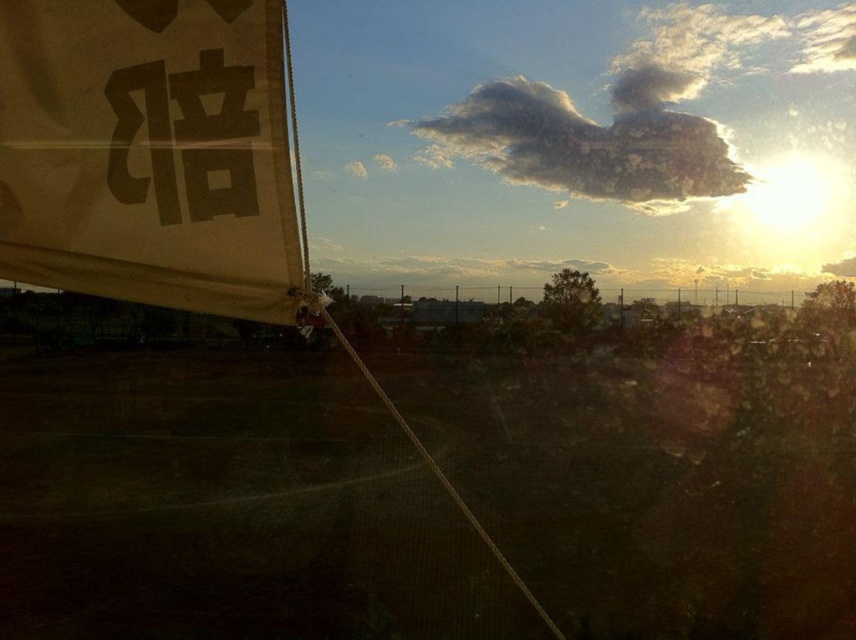
Looking at this image, you are standing in the outdoor scene and want to take a photo of the white fabric sign at upper left and the white fluffy cloud at upper center. Which object will appear larger in your photo?

The white fabric sign at upper left will appear larger in the photo because it is closer to the viewer than the white fluffy cloud at upper center.

You are an artist setting up an easel to paint the scene. You notice the white fabric sign at upper left and the white fluffy cloud at upper center in your view. Which object is shorter in height?

The white fabric sign at upper left is not as tall as the white fluffy cloud at upper center, so the white fabric sign at upper left is shorter in height.